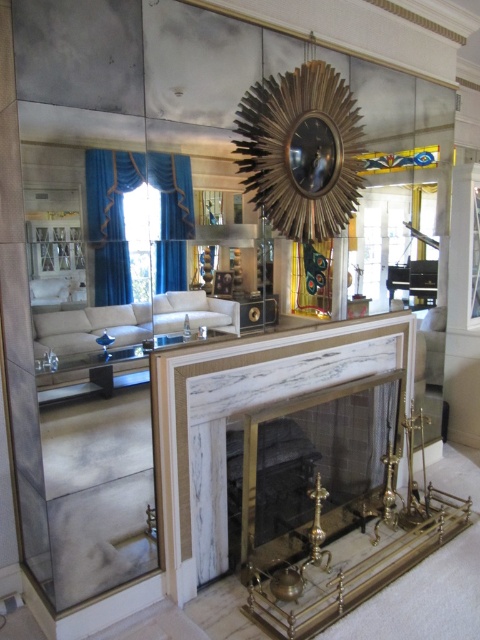
Which is above, gold metallic clock at upper center or white leather sofa at center?

gold metallic clock at upper center is higher up.

Is gold metallic clock at upper center further to camera compared to white leather sofa at center?

Yes, gold metallic clock at upper center is behind white leather sofa at center.

Is point (299, 173) behind point (180, 292)?

Yes, it is.

This screenshot has height=640, width=480. I want to click on gold metallic clock at upper center, so click(x=313, y=154).

Where is `gold textured sunburst clock at center`? The width and height of the screenshot is (480, 640). gold textured sunburst clock at center is located at coordinates (301, 150).

Who is positioned more to the right, gold textured sunburst clock at center or white leather sofa at center?

gold textured sunburst clock at center

The width and height of the screenshot is (480, 640). Describe the element at coordinates (301, 150) in the screenshot. I see `gold textured sunburst clock at center` at that location.

This screenshot has height=640, width=480. Identify the location of gold textured sunburst clock at center. (301, 150).

Who is shorter, gold textured sunburst clock at center or white marble fireplace at center?

white marble fireplace at center

This screenshot has height=640, width=480. What are the coordinates of `gold textured sunburst clock at center` in the screenshot? It's located at (301, 150).

The image size is (480, 640). In order to click on gold textured sunburst clock at center in this screenshot , I will do `click(301, 150)`.